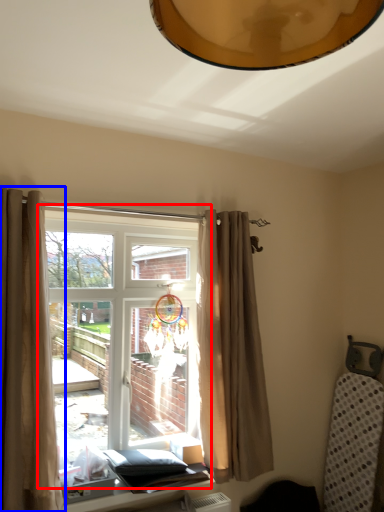
Question: Which object is closer to the camera taking this photo, window (highlighted by a red box) or curtain (highlighted by a blue box)?

Choices:
 (A) window
 (B) curtain

Answer: (B)